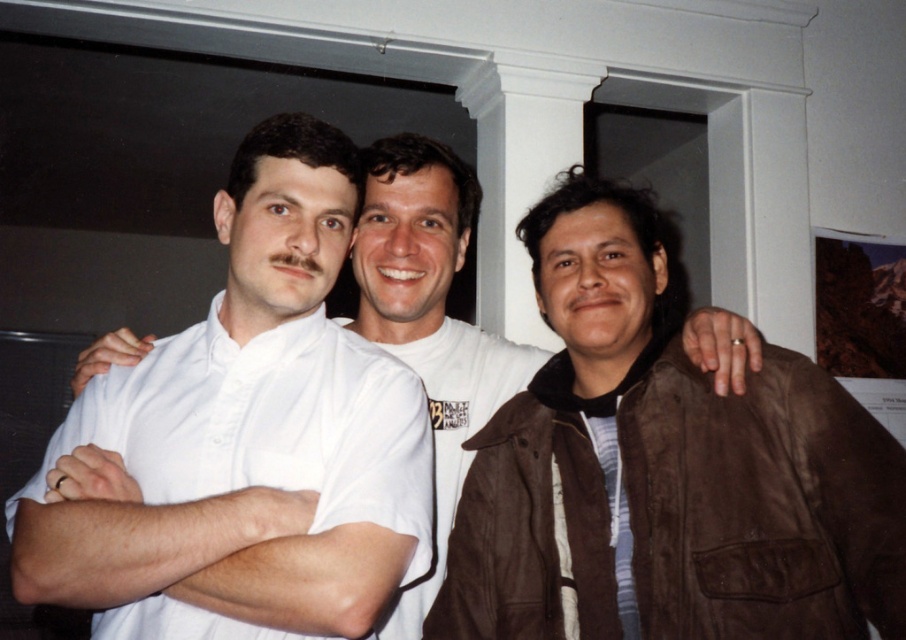
You are a photographer trying to adjust the spacing between the two people in the photo to ensure they are exactly 15 inches apart. Currently, the brown suede jacket at right and the white shirt at center are positioned how close to that goal?

The brown suede jacket at right and the white shirt at center are currently 14.77 inches apart, which is very close to the desired 15 inches. They only need to move approximately 0.23 inches closer to reach the exact distance.

You are a photographer trying to adjust the lighting for a group photo. You notice the brown suede jacket at right and the striped cotton shirt at center. Which clothing item requires more space in the frame due to its width?

The brown suede jacket at right requires more space in the frame because its width surpasses that of the striped cotton shirt at center.

You are a photographer trying to adjust the spacing between the two subjects in the image. The brown suede jacket at right and the striped cotton shirt at center are currently 5.06 inches apart. If you want to create a more crowded composition, should you move them closer or farther apart?

To create a more crowded composition, you should move the brown suede jacket at right and the striped cotton shirt at center closer together since they are currently 5.06 inches apart.